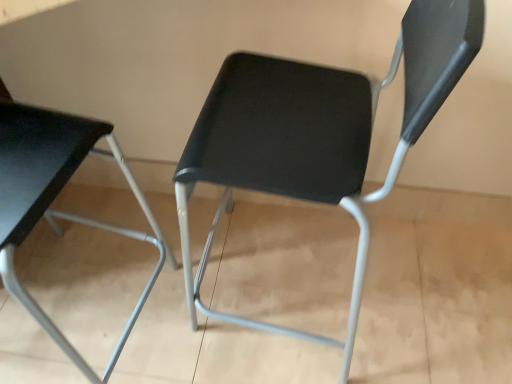
You are a GUI agent. You are given a task and a screenshot of the screen. Output one action in this format:
    pyautogui.click(x=<x>, y=<y>)
    Task: Click on the vacant space to the right of matte black chair at center, positioned as the 2th chair in left-to-right order
    The height and width of the screenshot is (384, 512).
    Given the screenshot: What is the action you would take?
    pyautogui.click(x=423, y=292)